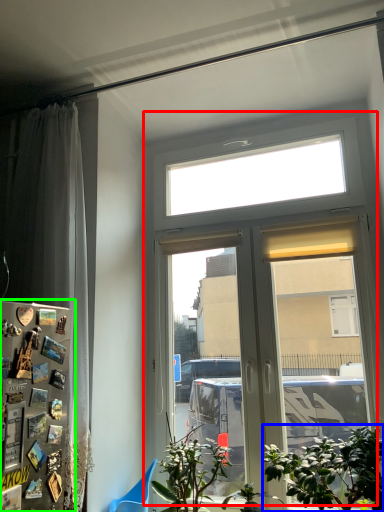
Question: Considering the real-world distances, which object is farthest from window (highlighted by a red box)? houseplant (highlighted by a blue box) or fridge (highlighted by a green box)?

Choices:
 (A) houseplant
 (B) fridge

Answer: (B)